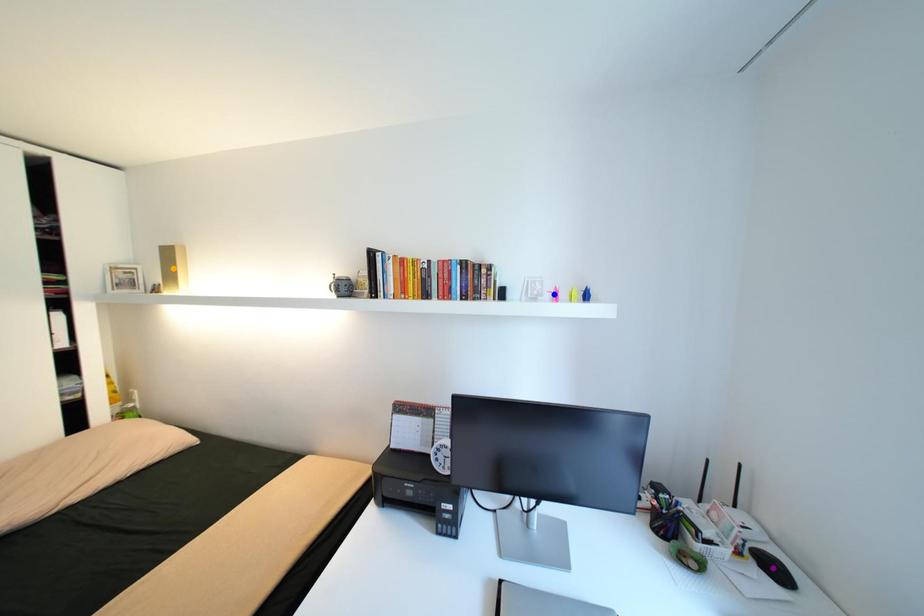
Order these from nearest to farthest:
- purple point
- blue point
- orange point

1. purple point
2. blue point
3. orange point